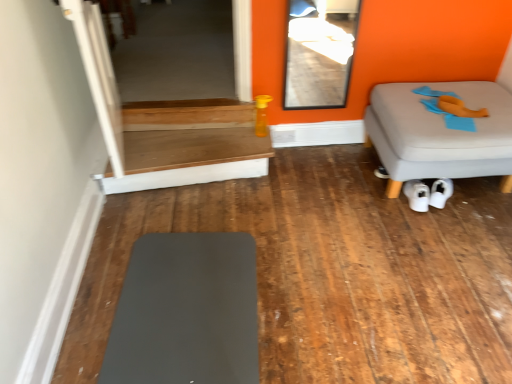
Question: From the image's perspective, does wooden table at center appear higher than matte gray mat at lower left, the 2th furniture positioned from the back?

Choices:
 (A) no
 (B) yes

Answer: (B)

Question: Can we say wooden table at center lies outside matte gray mat at lower left, the 2th furniture positioned from the back?

Choices:
 (A) no
 (B) yes

Answer: (B)

Question: Does wooden table at center appear on the left side of matte gray mat at lower left, marked as the first furniture in a left-to-right arrangement?

Choices:
 (A) yes
 (B) no

Answer: (A)

Question: Considering the relative sizes of wooden table at center and matte gray mat at lower left, marked as the first furniture in a left-to-right arrangement, in the image provided, is wooden table at center smaller than matte gray mat at lower left, marked as the first furniture in a left-to-right arrangement,?

Choices:
 (A) no
 (B) yes

Answer: (A)

Question: Considering the relative sizes of wooden table at center and matte gray mat at lower left, the first furniture from the front, in the image provided, is wooden table at center bigger than matte gray mat at lower left, the first furniture from the front,?

Choices:
 (A) yes
 (B) no

Answer: (A)

Question: Is transparent glass door at upper left, the second glass door viewed from the front, inside or outside of gray fabric ottoman at right, the first furniture in the top-to-bottom sequence?

Choices:
 (A) inside
 (B) outside

Answer: (B)

Question: From a real-world perspective, is transparent glass door at upper left, which is the first glass door from left to right, positioned above or below gray fabric ottoman at right, the first furniture in the top-to-bottom sequence?

Choices:
 (A) above
 (B) below

Answer: (A)

Question: Based on their positions, is transparent glass door at upper left, the second glass door viewed from the front, located to the left or right of gray fabric ottoman at right, the first furniture in the top-to-bottom sequence?

Choices:
 (A) right
 (B) left

Answer: (B)

Question: From their relative heights in the image, would you say transparent glass door at upper left, which is the 1th glass door from back to front, is taller or shorter than gray fabric ottoman at right, acting as the 2th furniture starting from the bottom?

Choices:
 (A) tall
 (B) short

Answer: (B)

Question: Is white matte sneakers at lower center in front of or behind wooden table at center in the image?

Choices:
 (A) front
 (B) behind

Answer: (A)

Question: Based on their positions, is white matte sneakers at lower center located to the left or right of wooden table at center?

Choices:
 (A) left
 (B) right

Answer: (B)

Question: Looking at the image, does white matte sneakers at lower center seem bigger or smaller compared to wooden table at center?

Choices:
 (A) small
 (B) big

Answer: (A)

Question: From the image's perspective, relative to wooden table at center, is white matte sneakers at lower center above or below?

Choices:
 (A) above
 (B) below

Answer: (B)

Question: Is wooden table at center inside the boundaries of transparent glass door at upper left, which is the 1th glass door from back to front, or outside?

Choices:
 (A) inside
 (B) outside

Answer: (B)

Question: Based on their positions, is wooden table at center located to the left or right of transparent glass door at upper left, the second glass door viewed from the front?

Choices:
 (A) right
 (B) left

Answer: (A)